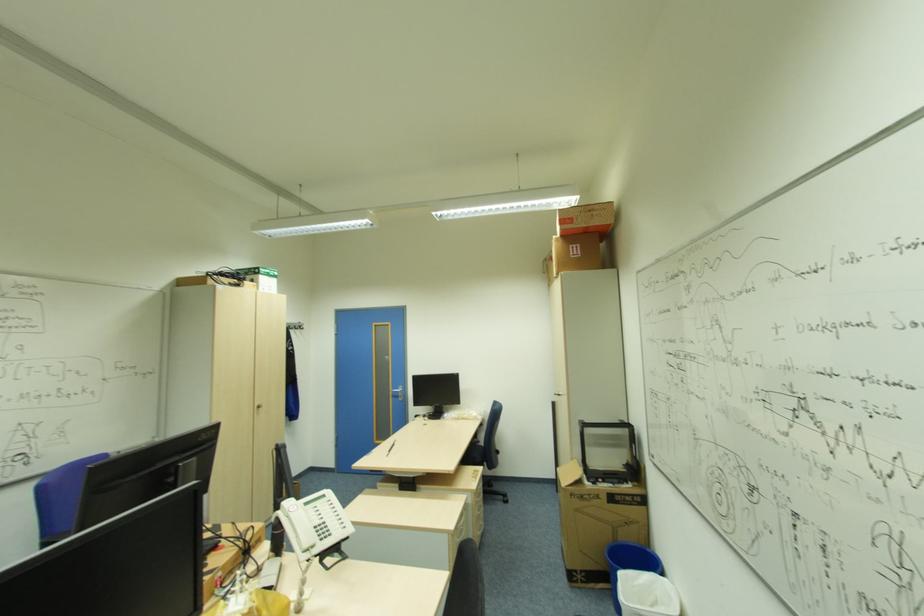
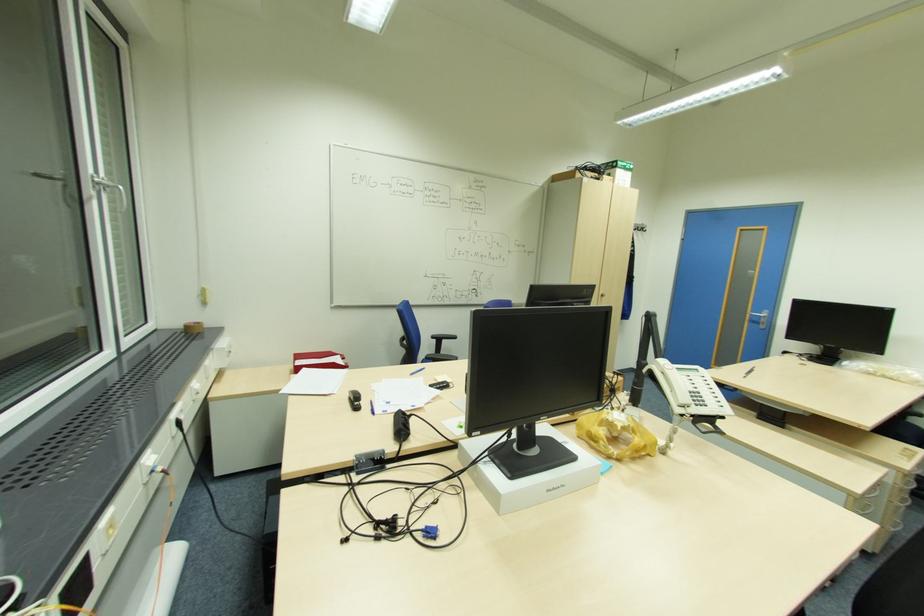
The point at (x=310, y=545) is marked in the first image. Where is the corresponding point in the second image?

(685, 400)